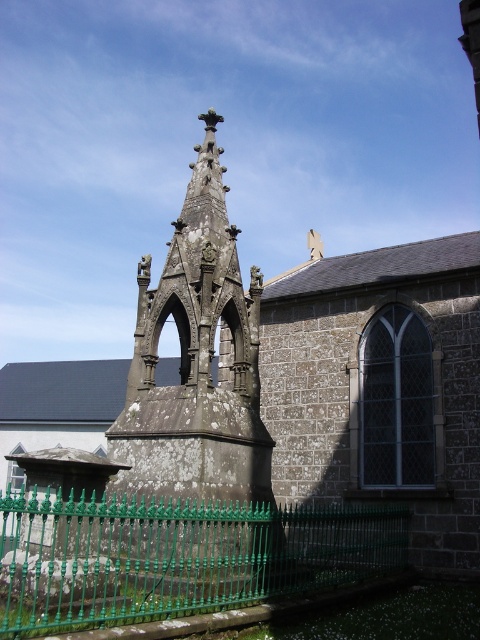
Is rough stone tower at center smaller than green wrought iron fence at lower center?

Indeed, rough stone tower at center has a smaller size compared to green wrought iron fence at lower center.

Can you confirm if rough stone tower at center is positioned to the left of green wrought iron fence at lower center?

In fact, rough stone tower at center is to the right of green wrought iron fence at lower center.

Who is more forward, (204, 314) or (128, 554)?

Positioned in front is point (128, 554).

The width and height of the screenshot is (480, 640). Find the location of `rough stone tower at center`. rough stone tower at center is located at coordinates (199, 396).